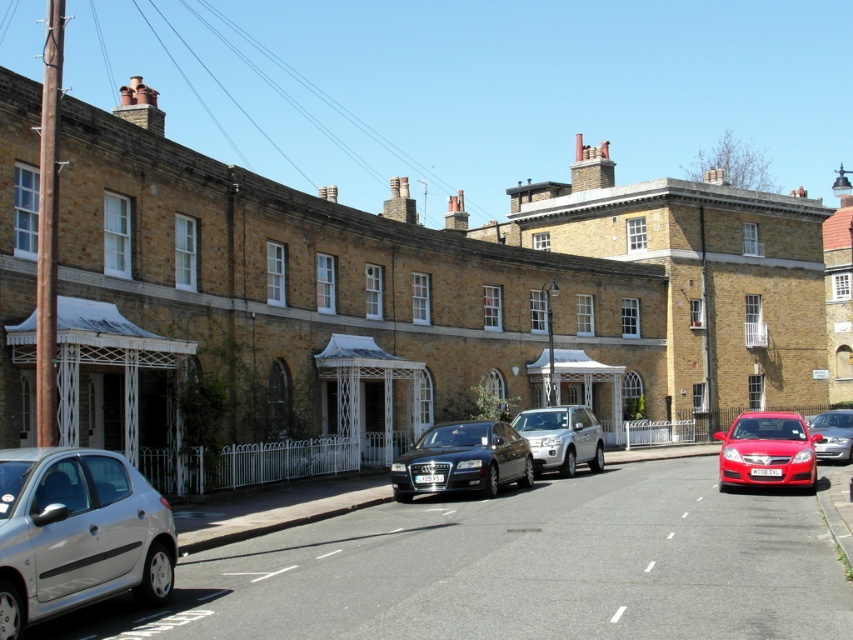
Can you confirm if shiny black sedan at center is positioned above shiny red sedan at lower right?

Yes.

Between shiny black sedan at center and shiny red sedan at lower right, which one appears on the right side from the viewer's perspective?

shiny red sedan at lower right is more to the right.

The width and height of the screenshot is (853, 640). What do you see at coordinates (462, 460) in the screenshot?
I see `shiny black sedan at center` at bounding box center [462, 460].

Where is `shiny black sedan at center`? This screenshot has height=640, width=853. shiny black sedan at center is located at coordinates (462, 460).

Between silver metallic hatchback at lower left and shiny black sedan at center, which one is positioned lower?

Positioned lower is shiny black sedan at center.

Is silver metallic hatchback at lower left shorter than shiny black sedan at center?

Yes.

The width and height of the screenshot is (853, 640). I want to click on silver metallic hatchback at lower left, so point(77,532).

Find the location of a particular element. silver metallic hatchback at lower left is located at coordinates (77, 532).

Who is more forward, (39, 502) or (558, 452)?

Point (39, 502)

Is silver metallic hatchback at lower left smaller than silver metallic suv at center?

Correct, silver metallic hatchback at lower left occupies less space than silver metallic suv at center.

Is point (35, 502) closer to viewer compared to point (563, 445)?

Yes, it is in front of point (563, 445).

Where is `silver metallic hatchback at lower left`? The width and height of the screenshot is (853, 640). silver metallic hatchback at lower left is located at coordinates (77, 532).